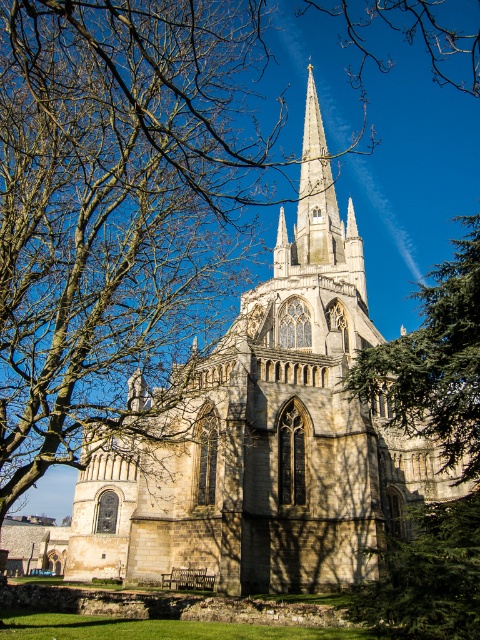
Question: Is stone church at center positioned behind green textured pine tree at lower right?

Choices:
 (A) yes
 (B) no

Answer: (A)

Question: Which of the following is the farthest from the observer?

Choices:
 (A) (311, 196)
 (B) (339, 570)

Answer: (A)

Question: Observing the image, what is the correct spatial positioning of stone church at center in reference to green leafy tree at right?

Choices:
 (A) below
 (B) above

Answer: (B)

Question: Among these points, which one is farthest from the camera?

Choices:
 (A) (424, 298)
 (B) (452, 593)

Answer: (A)

Question: Which of the following is the closest to the observer?

Choices:
 (A) green leafy tree at right
 (B) stone church at center

Answer: (A)

Question: Observing the image, what is the correct spatial positioning of green textured pine tree at lower right in reference to white stone spire at upper center?

Choices:
 (A) above
 (B) below

Answer: (B)